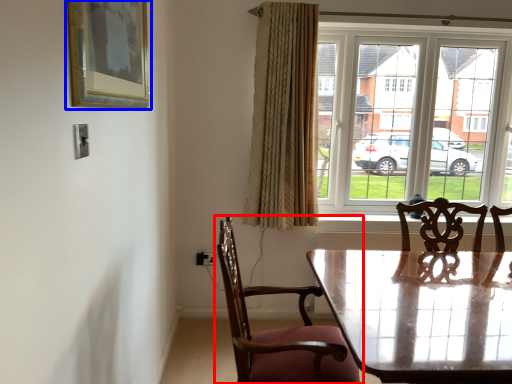
Question: Which point is closer to the camera, chair (highlighted by a red box) or picture frame (highlighted by a blue box)?

Choices:
 (A) chair
 (B) picture frame

Answer: (B)